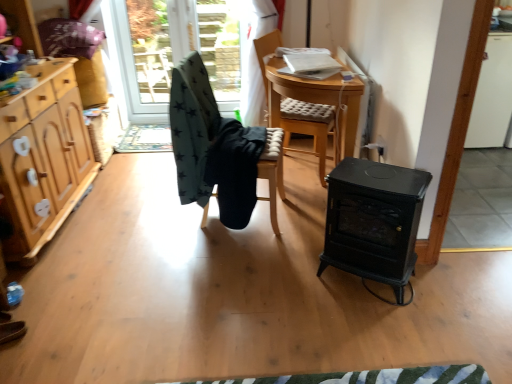
Question: From a real-world perspective, is wooden chair with cushion at center, the 3th chair positioned from the left, on top of black fabric chair at center, marked as the 2th chair in a right-to-left arrangement?

Choices:
 (A) no
 (B) yes

Answer: (B)

Question: Is wooden chair with cushion at center, marked as the 1th chair in a right-to-left arrangement, taller than black fabric chair at center, the 2th chair positioned from the left?

Choices:
 (A) yes
 (B) no

Answer: (A)

Question: From the image's perspective, does wooden chair with cushion at center, marked as the 1th chair in a right-to-left arrangement, appear lower than black fabric chair at center, the 2th chair positioned from the left?

Choices:
 (A) no
 (B) yes

Answer: (A)

Question: Does wooden chair with cushion at center, marked as the 1th chair in a right-to-left arrangement, have a lesser height compared to black fabric chair at center, marked as the 2th chair in a right-to-left arrangement?

Choices:
 (A) yes
 (B) no

Answer: (B)

Question: Is wooden chair with cushion at center, marked as the 1th chair in a right-to-left arrangement, in front of black fabric chair at center, marked as the 2th chair in a right-to-left arrangement?

Choices:
 (A) no
 (B) yes

Answer: (A)

Question: Is wooden chair with cushion at center, marked as the 1th chair in a right-to-left arrangement, touching black fabric chair at center, the 2th chair positioned from the left?

Choices:
 (A) no
 (B) yes

Answer: (A)

Question: Is black fabric chair at center, the 2th chair positioned from the left, at the back of transparent glass door at upper center, marked as the first window screen in a left-to-right arrangement?

Choices:
 (A) no
 (B) yes

Answer: (A)

Question: Is transparent glass door at upper center, marked as the first window screen in a left-to-right arrangement, at the right side of black fabric chair at center, the 2th chair positioned from the left?

Choices:
 (A) yes
 (B) no

Answer: (B)

Question: Is transparent glass door at upper center, the 2th window screen in the right-to-left sequence, oriented towards black fabric chair at center, marked as the 2th chair in a right-to-left arrangement?

Choices:
 (A) no
 (B) yes

Answer: (A)

Question: From a real-world perspective, is transparent glass door at upper center, the 2th window screen in the right-to-left sequence, positioned under black fabric chair at center, the 2th chair positioned from the left, based on gravity?

Choices:
 (A) yes
 (B) no

Answer: (B)

Question: Can you confirm if transparent glass door at upper center, marked as the first window screen in a left-to-right arrangement, is wider than black fabric chair at center, marked as the 2th chair in a right-to-left arrangement?

Choices:
 (A) yes
 (B) no

Answer: (B)

Question: Is transparent glass door at upper center, the 2th window screen in the right-to-left sequence, outside of black fabric chair at center, marked as the 2th chair in a right-to-left arrangement?

Choices:
 (A) no
 (B) yes

Answer: (B)

Question: Is dark green fabric chair at center, positioned as the third chair in right-to-left order, looking in the opposite direction of wooden chair with cushion at center, marked as the 1th chair in a right-to-left arrangement?

Choices:
 (A) no
 (B) yes

Answer: (A)